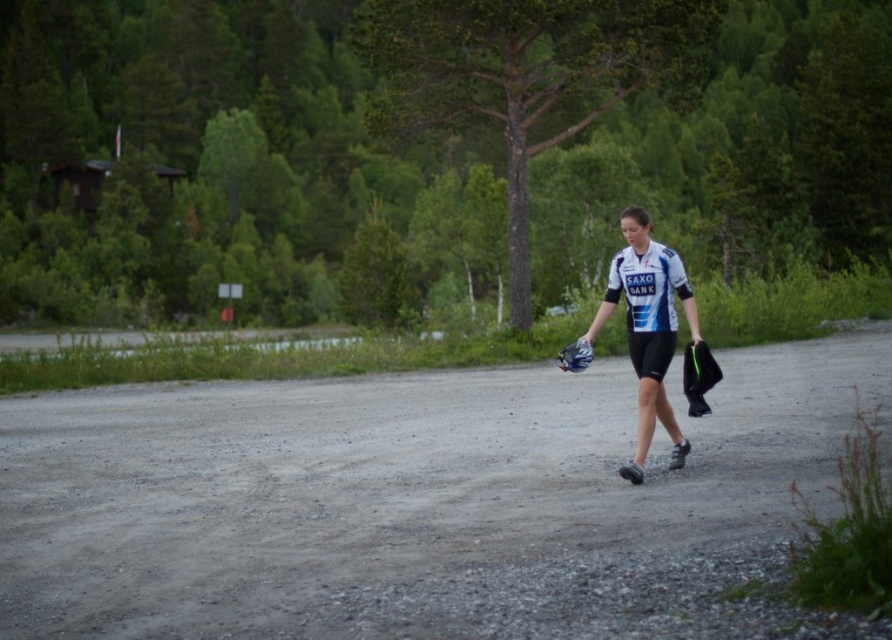
Does point (715, 433) come behind point (589, 362)?

Yes, point (715, 433) is behind point (589, 362).

The height and width of the screenshot is (640, 892). In order to click on gray gravel road at center in this screenshot , I will do `click(417, 502)`.

Identify the location of gray gravel road at center. This screenshot has height=640, width=892. (417, 502).

Between gray gravel road at center and white jersey at center, which one appears on the right side from the viewer's perspective?

Positioned to the right is white jersey at center.

This screenshot has width=892, height=640. What do you see at coordinates (417, 502) in the screenshot?
I see `gray gravel road at center` at bounding box center [417, 502].

At what (x,y) coordinates should I click in order to perform the action: click on gray gravel road at center. Please return your answer as a coordinate pair (x, y). Looking at the image, I should click on (417, 502).

Can you confirm if white jersey at center is positioned below blue fabric baseball glove at center?

Yes, white jersey at center is below blue fabric baseball glove at center.

Does white jersey at center come behind blue fabric baseball glove at center?

No, it is in front of blue fabric baseball glove at center.

The height and width of the screenshot is (640, 892). Find the location of `white jersey at center`. white jersey at center is located at coordinates (648, 328).

This screenshot has width=892, height=640. Find the location of `white jersey at center`. white jersey at center is located at coordinates (648, 328).